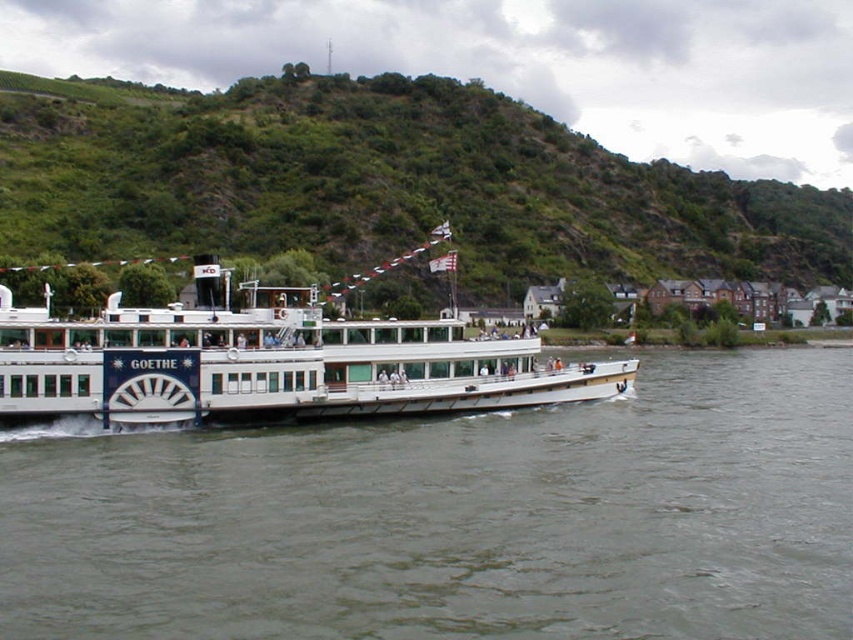
Question: Which object is positioned farthest from the gray water at center?

Choices:
 (A) white matte cruise ship at center
 (B) green grassy hillside at upper center

Answer: (B)

Question: Does gray water at center have a lesser width compared to white matte cruise ship at center?

Choices:
 (A) yes
 (B) no

Answer: (A)

Question: Which point is farther to the camera?

Choices:
 (A) green grassy hillside at upper center
 (B) white matte cruise ship at center
 (C) gray water at center

Answer: (A)

Question: Does gray water at center appear under white matte cruise ship at center?

Choices:
 (A) yes
 (B) no

Answer: (A)

Question: Which of the following is the closest to the observer?

Choices:
 (A) (76, 410)
 (B) (689, 435)
 (C) (581, 138)

Answer: (A)

Question: Does green grassy hillside at upper center appear on the left side of white matte cruise ship at center?

Choices:
 (A) yes
 (B) no

Answer: (B)